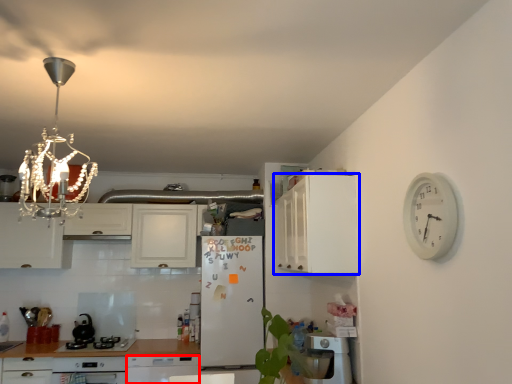
Question: Which object is closer to the camera taking this photo, dish washer (highlighted by a red box) or cabinetry (highlighted by a blue box)?

Choices:
 (A) dish washer
 (B) cabinetry

Answer: (B)